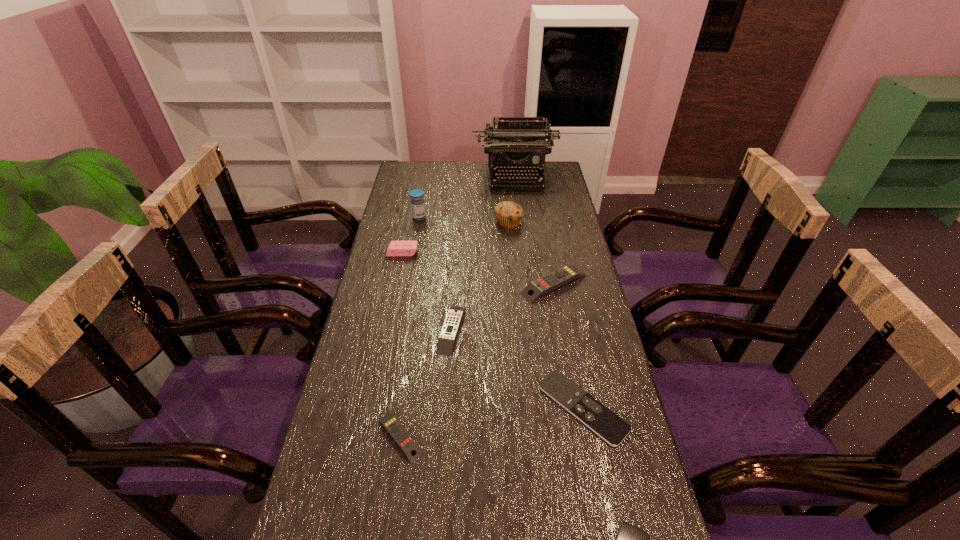
Identify the location of free region located on the left of the second smallest yellow remote control. The image size is (960, 540). (367, 329).

The height and width of the screenshot is (540, 960). I want to click on vacant position located on the right of the leftmost yellow remote control, so click(x=496, y=437).

In order to click on free spot located on the back of the bigger black remote control in this screenshot , I will do `click(566, 326)`.

This screenshot has width=960, height=540. I want to click on object situated at the far edge, so click(x=515, y=144).

You are a GUI agent. You are given a task and a screenshot of the screen. Output one action in this format:
    pyautogui.click(x=<x>, y=<y>)
    Task: Click on the medicine situated at the left edge
    Image resolution: width=960 pixels, height=540 pixels.
    Given the screenshot: What is the action you would take?
    pyautogui.click(x=417, y=201)

At what (x,y) coordinates should I click in order to perform the action: click on eraser situated at the left edge. Please return your answer as a coordinate pair (x, y). Looking at the image, I should click on (395, 248).

Image resolution: width=960 pixels, height=540 pixels. Identify the location of remote control situated at the left edge. (402, 438).

Where is `typewriter situated at the right edge`? The image size is (960, 540). typewriter situated at the right edge is located at coordinates (515, 144).

Where is `object that is at the far right corner`? The image size is (960, 540). object that is at the far right corner is located at coordinates (515, 144).

The image size is (960, 540). In order to click on vacant space at the far edge in this screenshot , I will do (x=439, y=187).